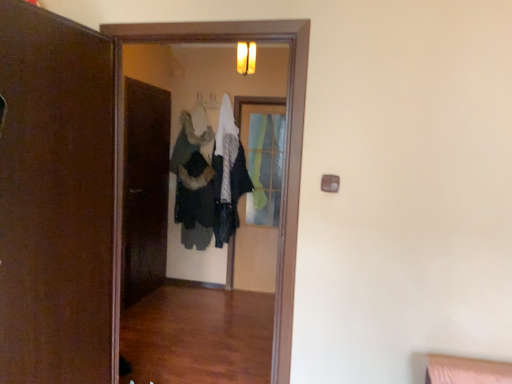
Question: From a real-world perspective, is clear glass screen door at center, which appears as the second screen door when viewed from the front, beneath brown matte door at left?

Choices:
 (A) no
 (B) yes

Answer: (B)

Question: From a real-world perspective, is clear glass screen door at center, positioned as the 1th screen door in back-to-front order, physically above brown matte door at left?

Choices:
 (A) no
 (B) yes

Answer: (A)

Question: Does clear glass screen door at center, which appears as the second screen door when viewed from the front, have a smaller size compared to brown matte door at left?

Choices:
 (A) no
 (B) yes

Answer: (B)

Question: From the image's perspective, would you say clear glass screen door at center, which appears as the second screen door when viewed from the front, is shown under brown matte door at left?

Choices:
 (A) yes
 (B) no

Answer: (B)

Question: Is clear glass screen door at center, which appears as the second screen door when viewed from the front, aimed at brown matte door at left?

Choices:
 (A) yes
 (B) no

Answer: (A)

Question: Considering their positions, is wooden screen door at center, the 2th screen door viewed from the back, located in front of or behind dark gray fabric coat at center?

Choices:
 (A) behind
 (B) front

Answer: (B)

Question: Considering the positions of wooden screen door at center, the 2th screen door viewed from the back, and dark gray fabric coat at center in the image, is wooden screen door at center, the 2th screen door viewed from the back, bigger or smaller than dark gray fabric coat at center?

Choices:
 (A) big
 (B) small

Answer: (B)

Question: In terms of height, does wooden screen door at center, the first screen door viewed from the front, look taller or shorter compared to dark gray fabric coat at center?

Choices:
 (A) short
 (B) tall

Answer: (B)

Question: In the image, is wooden screen door at center, the 2th screen door viewed from the back, on the left side or the right side of dark gray fabric coat at center?

Choices:
 (A) left
 (B) right

Answer: (A)

Question: Relative to clear glass screen door at center, which appears as the second screen door when viewed from the front, is dark gray fabric coat at center in front or behind?

Choices:
 (A) behind
 (B) front

Answer: (B)

Question: Is dark gray fabric coat at center to the left or to the right of clear glass screen door at center, positioned as the 1th screen door in back-to-front order, in the image?

Choices:
 (A) right
 (B) left

Answer: (B)

Question: From a real-world perspective, is dark gray fabric coat at center positioned above or below clear glass screen door at center, positioned as the 1th screen door in back-to-front order?

Choices:
 (A) above
 (B) below

Answer: (A)

Question: In terms of width, does dark gray fabric coat at center look wider or thinner when compared to clear glass screen door at center, which appears as the second screen door when viewed from the front?

Choices:
 (A) thin
 (B) wide

Answer: (B)

Question: Is point (212, 200) closer or farther from the camera than point (92, 62)?

Choices:
 (A) farther
 (B) closer

Answer: (A)

Question: Considering the positions of dark gray fabric coat at center and brown matte door at left in the image, is dark gray fabric coat at center wider or thinner than brown matte door at left?

Choices:
 (A) thin
 (B) wide

Answer: (B)